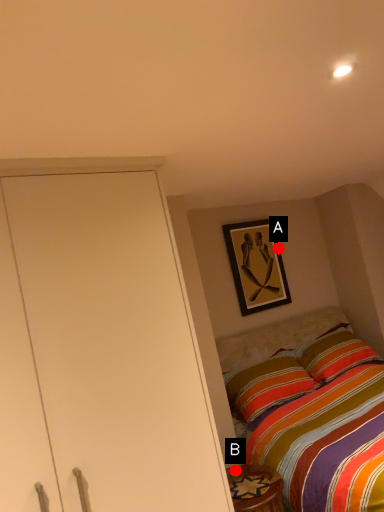
Question: Two points are circled on the image, labeled by A and B beside each circle. Which point is closer to the camera?

Choices:
 (A) A is closer
 (B) B is closer

Answer: (B)